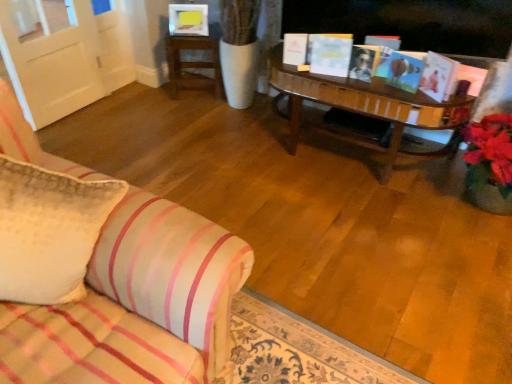
How much space does white matte book at upper center, which is counted as the first book, starting from the left, occupy vertically?

15.18 centimeters.

Image resolution: width=512 pixels, height=384 pixels. Find the location of `white textured pillow at left`. white textured pillow at left is located at coordinates (49, 231).

Based on the photo, from the image's perspective, between matte pink book at upper right, which ranks as the 3th book in left-to-right order, and white textured pillow at left, who is located below?

From the image's view, white textured pillow at left is below.

Does matte pink book at upper right, which ranks as the 3th book in left-to-right order, have a lesser width compared to white textured pillow at left?

Yes, matte pink book at upper right, which ranks as the 3th book in left-to-right order, is thinner than white textured pillow at left.

Is matte pink book at upper right, which ranks as the 3th book in left-to-right order, far from white textured pillow at left?

Yes, matte pink book at upper right, which ranks as the 3th book in left-to-right order, and white textured pillow at left are located far from each other.

Does matte pink book at upper right, which ranks as the 3th book in left-to-right order, turn towards white textured pillow at left?

Yes.

From the image's perspective, who appears lower, white paper book at center, arranged as the second book when viewed from the right, or white textured pillow at left?

white textured pillow at left, from the image's perspective.

Considering the points (342, 51) and (61, 258), which point is in front, point (342, 51) or point (61, 258)?

The point (61, 258) is closer to the camera.

Between white paper book at center, which is counted as the second book, starting from the left, and white textured pillow at left, which one appears on the left side from the viewer's perspective?

white textured pillow at left is more to the left.

Considering the sizes of white paper book at center, which is counted as the second book, starting from the left, and white textured pillow at left in the image, is white paper book at center, which is counted as the second book, starting from the left, wider or thinner than white textured pillow at left?

white paper book at center, which is counted as the second book, starting from the left, is thinner than white textured pillow at left.

From the image's perspective, which one is positioned lower, white paper book at center, which is counted as the second book, starting from the left, or white matte book at upper center, marked as the third book in a right-to-left arrangement?

From the image's view, white paper book at center, which is counted as the second book, starting from the left, is below.

Is white paper book at center, arranged as the second book when viewed from the right, oriented towards white matte book at upper center, which is counted as the first book, starting from the left?

No, white paper book at center, arranged as the second book when viewed from the right, is not aimed at white matte book at upper center, which is counted as the first book, starting from the left.

Can you see white paper book at center, arranged as the second book when viewed from the right, touching white matte book at upper center, marked as the third book in a right-to-left arrangement?

white paper book at center, arranged as the second book when viewed from the right, and white matte book at upper center, marked as the third book in a right-to-left arrangement, are clearly separated.

From a real-world perspective, is white textured pillow at left positioned above or below wooden table at upper center?

From a real-world perspective, white textured pillow at left is physically above wooden table at upper center.

Considering the relative sizes of white textured pillow at left and wooden table at upper center in the image provided, is white textured pillow at left bigger than wooden table at upper center?

Yes.

Considering the points (12, 162) and (184, 85), which point is in front, point (12, 162) or point (184, 85)?

Positioned in front is point (12, 162).

Are white textured pillow at left and wooden table at upper center far apart?

Yes, white textured pillow at left and wooden table at upper center are located far from each other.

Is white textured pillow at left in front of or behind matte pink book at upper right, which is the 1th book from right to left, in the image?

white textured pillow at left is positioned closer to the viewer than matte pink book at upper right, which is the 1th book from right to left.

Does white textured pillow at left have a lesser width compared to matte pink book at upper right, which ranks as the 3th book in left-to-right order?

Incorrect, the width of white textured pillow at left is not less than that of matte pink book at upper right, which ranks as the 3th book in left-to-right order.

Which is more to the right, white textured pillow at left or matte pink book at upper right, which ranks as the 3th book in left-to-right order?

Positioned to the right is matte pink book at upper right, which ranks as the 3th book in left-to-right order.

From the image's perspective, which is below, wooden table at upper center or white paper book at center, which is counted as the second book, starting from the left?

white paper book at center, which is counted as the second book, starting from the left, appears lower in the image.

Considering the positions of objects wooden table at upper center and white paper book at center, which is counted as the second book, starting from the left, in the image provided, who is more to the right, wooden table at upper center or white paper book at center, which is counted as the second book, starting from the left,?

Positioned to the right is white paper book at center, which is counted as the second book, starting from the left.

Which is behind, wooden table at upper center or white paper book at center, which is counted as the second book, starting from the left?

wooden table at upper center is further away from the camera.

Considering the sizes of objects wooden table at upper center and white paper book at center, arranged as the second book when viewed from the right, in the image provided, who is taller, wooden table at upper center or white paper book at center, arranged as the second book when viewed from the right,?

wooden table at upper center is taller.

Between point (346, 55) and point (183, 41), which one is positioned behind?

The point (183, 41) is farther from the camera.

How different are the orientations of white paper book at center, arranged as the second book when viewed from the right, and wooden table at upper center in degrees?

The angular difference between white paper book at center, arranged as the second book when viewed from the right, and wooden table at upper center is 20.1 degrees.

Is wooden table at upper center inside white paper book at center, arranged as the second book when viewed from the right?

Actually, wooden table at upper center is outside white paper book at center, arranged as the second book when viewed from the right.

Where is `pillow lying in front of the matte pink book at upper right, which ranks as the 3th book in left-to-right order`? pillow lying in front of the matte pink book at upper right, which ranks as the 3th book in left-to-right order is located at coordinates (49, 231).

The height and width of the screenshot is (384, 512). Find the location of `pillow below the white paper book at center, which is counted as the second book, starting from the left (from the image's perspective)`. pillow below the white paper book at center, which is counted as the second book, starting from the left (from the image's perspective) is located at coordinates (49, 231).

Looking at the image, which one is located further to matte pink book at upper right, which ranks as the 3th book in left-to-right order, wooden table at upper center or white textured pillow at left?

white textured pillow at left is further to matte pink book at upper right, which ranks as the 3th book in left-to-right order.

Looking at the image, which one is located closer to white matte book at upper center, which is counted as the first book, starting from the left, white textured pillow at left or matte pink book at upper right, which ranks as the 3th book in left-to-right order?

The object closer to white matte book at upper center, which is counted as the first book, starting from the left, is matte pink book at upper right, which ranks as the 3th book in left-to-right order.

From the image, which object appears to be nearer to white paper book at center, arranged as the second book when viewed from the right, white matte book at upper center, which is counted as the first book, starting from the left, or white textured pillow at left?

Among the two, white matte book at upper center, which is counted as the first book, starting from the left, is located nearer to white paper book at center, arranged as the second book when viewed from the right.

Estimate the real-world distances between objects in this image. Which object is closer to white matte book at upper center, marked as the third book in a right-to-left arrangement, white paper book at center, arranged as the second book when viewed from the right, or matte pink book at upper right, which is the 1th book from right to left?

white paper book at center, arranged as the second book when viewed from the right, is positioned closer to the anchor white matte book at upper center, marked as the third book in a right-to-left arrangement.

Considering their positions, is matte pink book at upper right, which ranks as the 3th book in left-to-right order, positioned further to white paper book at center, arranged as the second book when viewed from the right, than wooden table at upper center?

Among the two, wooden table at upper center is located further to white paper book at center, arranged as the second book when viewed from the right.

Considering their positions, is white textured pillow at left positioned further to wooden table at upper center than white paper book at center, which is counted as the second book, starting from the left?

white textured pillow at left lies further to wooden table at upper center than the other object.

Which object lies nearer to the anchor point matte pink book at upper right, which ranks as the 3th book in left-to-right order, white textured pillow at left or white paper book at center, arranged as the second book when viewed from the right?

The object closer to matte pink book at upper right, which ranks as the 3th book in left-to-right order, is white paper book at center, arranged as the second book when viewed from the right.

Looking at the image, which one is located closer to white paper book at center, which is counted as the second book, starting from the left, white matte book at upper center, which is counted as the first book, starting from the left, or matte pink book at upper right, which is the 1th book from right to left?

Among the two, white matte book at upper center, which is counted as the first book, starting from the left, is located nearer to white paper book at center, which is counted as the second book, starting from the left.

Identify the location of book located between white matte book at upper center, marked as the third book in a right-to-left arrangement, and matte pink book at upper right, which ranks as the 3th book in left-to-right order, in the left-right direction. (330, 54).

I want to click on book between wooden table at upper center and white paper book at center, which is counted as the second book, starting from the left, so click(295, 48).